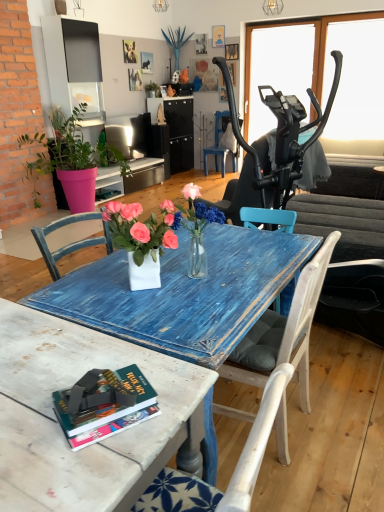
Where is `free location to the right of hardcover book at lower left`? free location to the right of hardcover book at lower left is located at coordinates (173, 397).